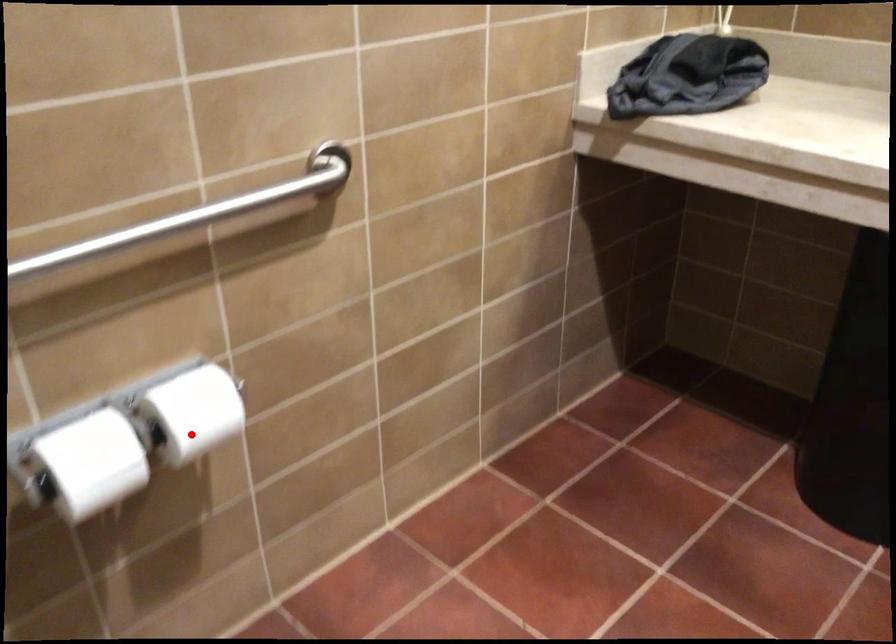
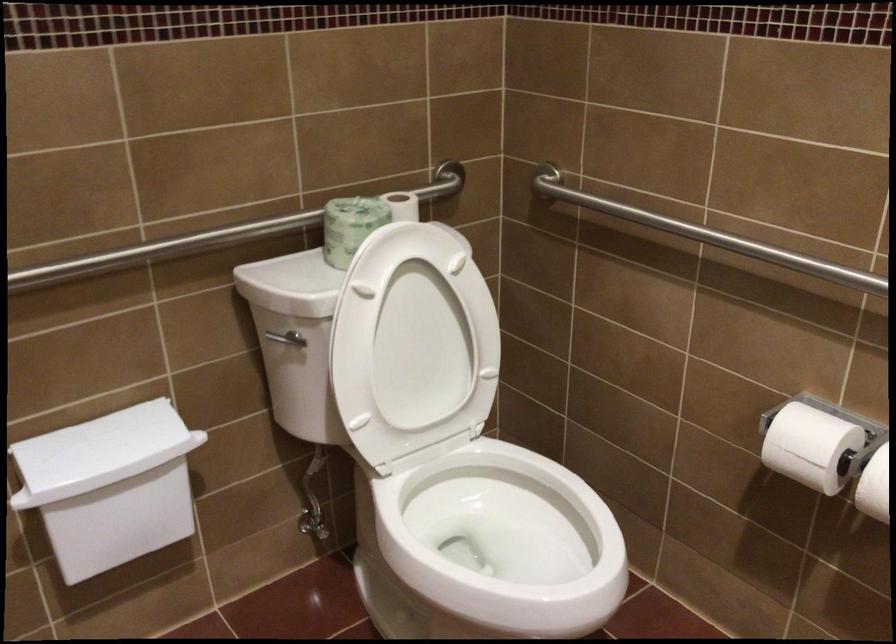
Question: I am providing you with two images of the same scene from different viewpoints. A red point is marked on the first image. Can you still see the location of the red point in image 2?

Choices:
 (A) Yes
 (B) No

Answer: (A)